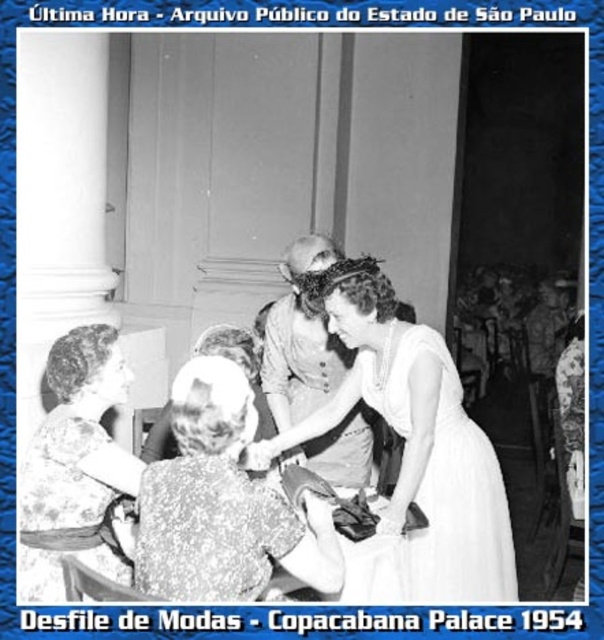
In the image of the 1954 fashion parade at the Copacabana Palace, there is a point labeled at coordinates (414, 444). What object is located at this point?

The point at coordinates (414, 444) corresponds to the white satin dress at center.

You are a photographer in 1954 trying to capture a closeup of the matte white dress at center. The camera you have can only focus on objects within 5 feet. Are you able to take the closeup from your current position?

The photographer is 7.12 feet away from the matte white dress at center, which is beyond the camera lens focusing range of 5 feet. Therefore, the photographer cannot take a closeup of the matte white dress at center from the current position.